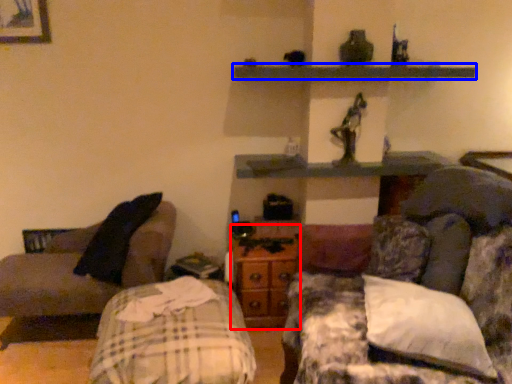
Question: Which of the following is the closest to the observer, dresser (highlighted by a red box) or shelf (highlighted by a blue box)?

Choices:
 (A) dresser
 (B) shelf

Answer: (B)